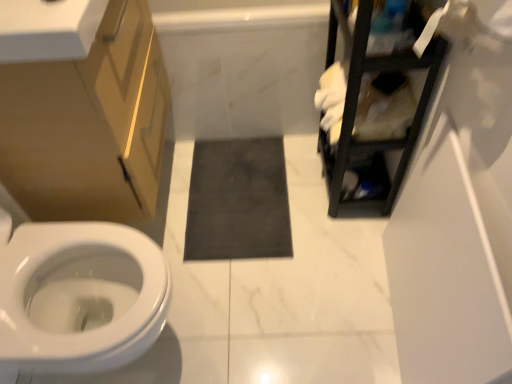
Image resolution: width=512 pixels, height=384 pixels. I want to click on vacant space to the right of matte gold cabinet at left, so click(247, 209).